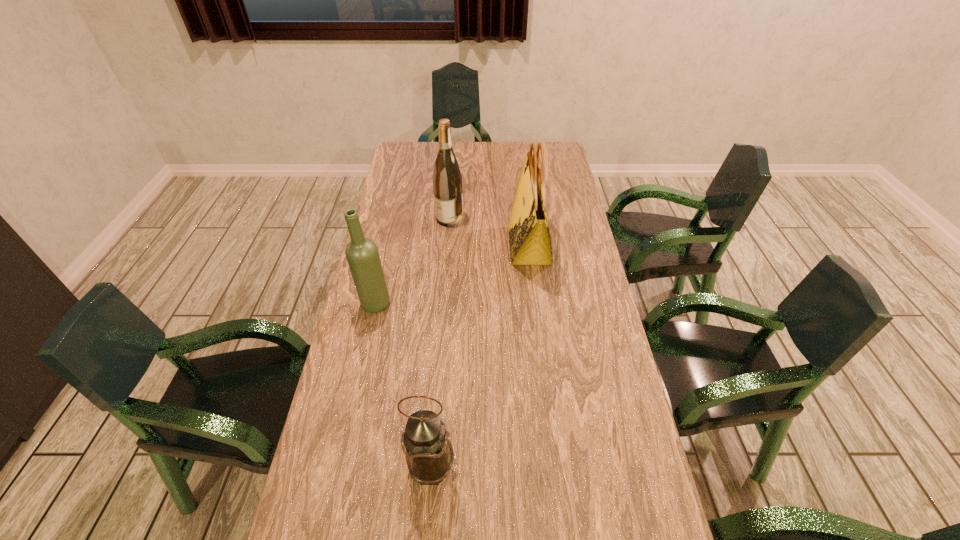
I want to click on the right wine bottle, so click(x=447, y=180).

You are a GUI agent. You are given a task and a screenshot of the screen. Output one action in this format:
    pyautogui.click(x=<x>, y=<y>)
    Task: Click on the rightmost object
    
    Given the screenshot: What is the action you would take?
    pyautogui.click(x=529, y=237)

At what (x,y) coordinates should I click in order to perform the action: click on the nearer wine bottle. Please return your answer as a coordinate pair (x, y). This screenshot has height=540, width=960. Looking at the image, I should click on (362, 255).

Image resolution: width=960 pixels, height=540 pixels. In order to click on the third farthest object in this screenshot , I will do `click(362, 255)`.

The image size is (960, 540). In order to click on oil lamp in this screenshot , I will do `click(429, 454)`.

What are the coordinates of `blank area located 0.150m on the front of the right wine bottle` in the screenshot? It's located at (446, 255).

Identify the location of free space located 0.350m on the front-facing side of the rightmost object. The height and width of the screenshot is (540, 960). (406, 245).

At what (x,y) coordinates should I click in order to perform the action: click on blank space located 0.370m on the front-facing side of the rightmost object. Please return your answer as a coordinate pair (x, y). Looking at the image, I should click on (400, 245).

Identify the location of vacant region located on the front-facing side of the rightmost object. (459, 245).

Where is `free space located 0.240m on the back of the leftmost object`? The width and height of the screenshot is (960, 540). free space located 0.240m on the back of the leftmost object is located at coordinates (389, 242).